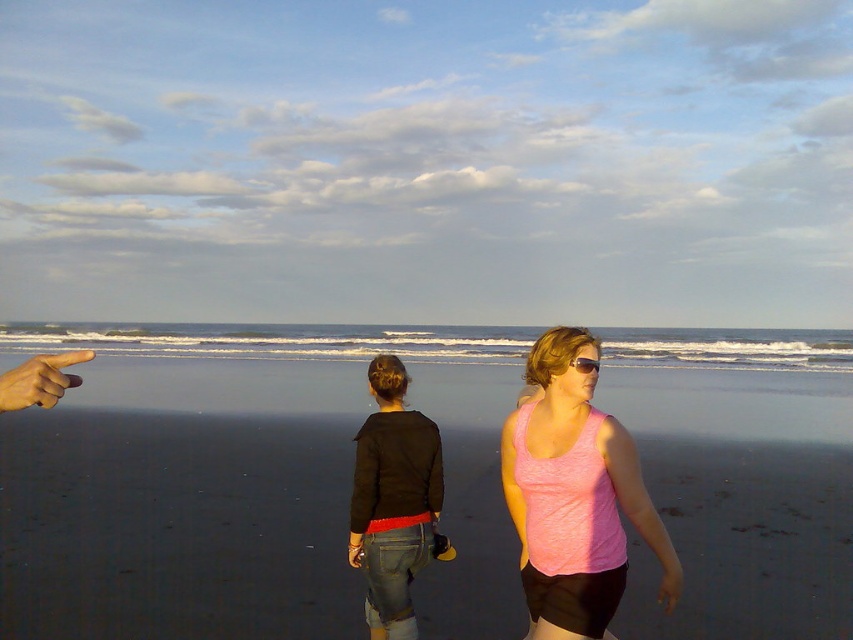
Question: Among these objects, which one is farthest from the camera?

Choices:
 (A) skinny tan finger at upper left
 (B) denim jeans at center
 (C) pink fabric tank top at center
 (D) pink matte sunglasses at center

Answer: (B)

Question: Is pink fabric tank top at center positioned behind denim jeans at center?

Choices:
 (A) yes
 (B) no

Answer: (B)

Question: Is denim jeans at center below skinny tan finger at upper left?

Choices:
 (A) yes
 (B) no

Answer: (A)

Question: Observing the image, what is the correct spatial positioning of smooth sand at center in reference to skinny tan finger at upper left?

Choices:
 (A) above
 (B) below

Answer: (B)

Question: Among these objects, which one is farthest from the camera?

Choices:
 (A) pink matte sunglasses at center
 (B) pink fabric tank top at center
 (C) denim jeans at center
 (D) smooth sand at center

Answer: (D)

Question: Which of the following is the closest to the observer?

Choices:
 (A) (525, 506)
 (B) (241, 518)

Answer: (A)